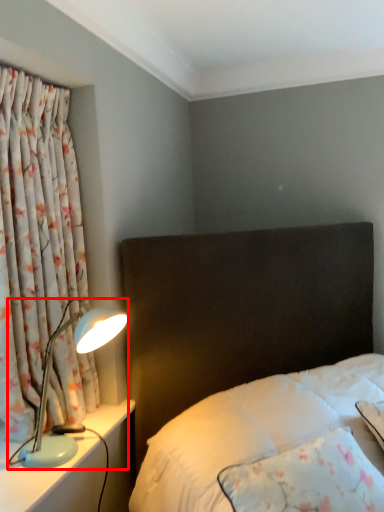
Question: In this image, where is lamp (annotated by the red box) located relative to curtain?

Choices:
 (A) left
 (B) right

Answer: (B)